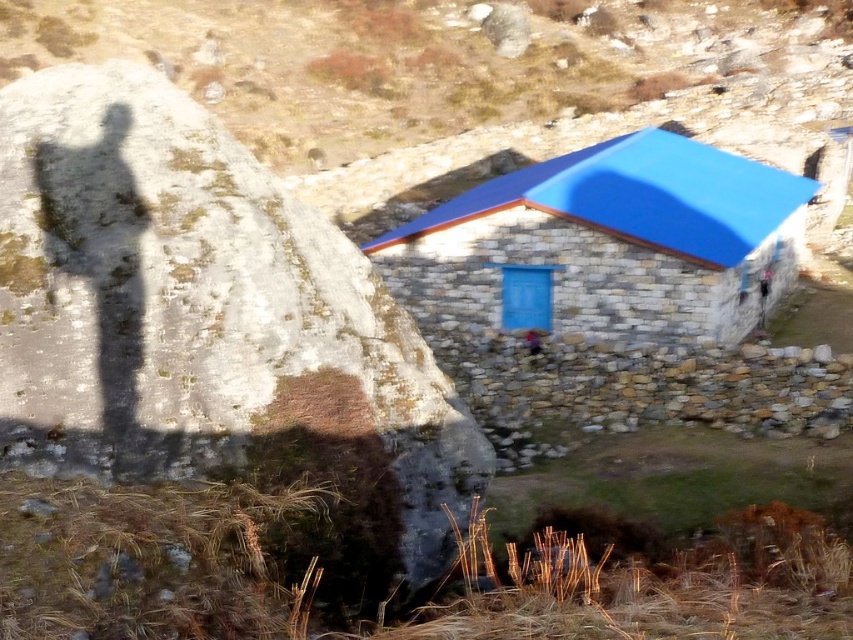
Question: Can you confirm if rusty stone boulder at left is smaller than blue stone hut at center?

Choices:
 (A) yes
 (B) no

Answer: (A)

Question: Does rusty stone boulder at left appear under blue stone hut at center?

Choices:
 (A) no
 (B) yes

Answer: (B)

Question: Which point appears closest to the camera in this image?

Choices:
 (A) (614, 212)
 (B) (402, 545)

Answer: (B)

Question: Can you confirm if rusty stone boulder at left is wider than blue stone hut at center?

Choices:
 (A) yes
 (B) no

Answer: (B)

Question: Which of the following is the farthest from the observer?

Choices:
 (A) blue stone hut at center
 (B) rusty stone boulder at left

Answer: (A)